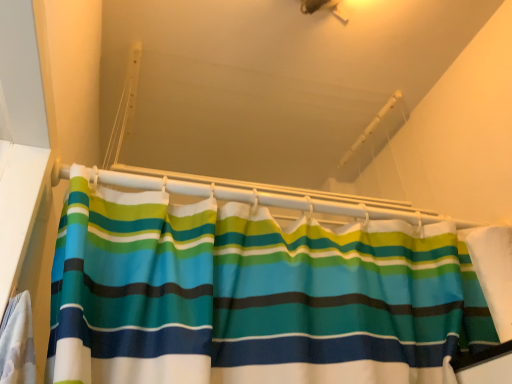
Question: Is the depth of white plastic shower curtain rod at upper center greater than that of white fabric at right?

Choices:
 (A) yes
 (B) no

Answer: (A)

Question: Considering the relative sizes of white plastic shower curtain rod at upper center and white fabric at right in the image provided, is white plastic shower curtain rod at upper center taller than white fabric at right?

Choices:
 (A) no
 (B) yes

Answer: (A)

Question: From the image's perspective, is white plastic shower curtain rod at upper center on top of white fabric at right?

Choices:
 (A) yes
 (B) no

Answer: (A)

Question: Is white plastic shower curtain rod at upper center touching white fabric at right?

Choices:
 (A) yes
 (B) no

Answer: (B)

Question: Considering the relative sizes of white plastic shower curtain rod at upper center and white fabric at right in the image provided, is white plastic shower curtain rod at upper center thinner than white fabric at right?

Choices:
 (A) no
 (B) yes

Answer: (B)

Question: Can white fabric at right be found inside white plastic shower curtain rod at upper center?

Choices:
 (A) yes
 (B) no

Answer: (B)

Question: From the image's perspective, is white fabric at right over white plastic shower curtain rod at upper center?

Choices:
 (A) no
 (B) yes

Answer: (A)

Question: From a real-world perspective, does white fabric at right stand above white plastic shower curtain rod at upper center?

Choices:
 (A) yes
 (B) no

Answer: (B)

Question: Does white fabric at right touch white plastic shower curtain rod at upper center?

Choices:
 (A) no
 (B) yes

Answer: (A)

Question: Does white fabric at right come behind white plastic shower curtain rod at upper center?

Choices:
 (A) no
 (B) yes

Answer: (A)

Question: Considering the relative sizes of white fabric at right and white plastic shower curtain rod at upper center in the image provided, is white fabric at right wider than white plastic shower curtain rod at upper center?

Choices:
 (A) yes
 (B) no

Answer: (A)

Question: From a real-world perspective, is white fabric at right located beneath white plastic shower curtain rod at upper center?

Choices:
 (A) no
 (B) yes

Answer: (B)

Question: Is white plastic shower curtain rod at upper center situated inside white fabric at right or outside?

Choices:
 (A) inside
 (B) outside

Answer: (B)